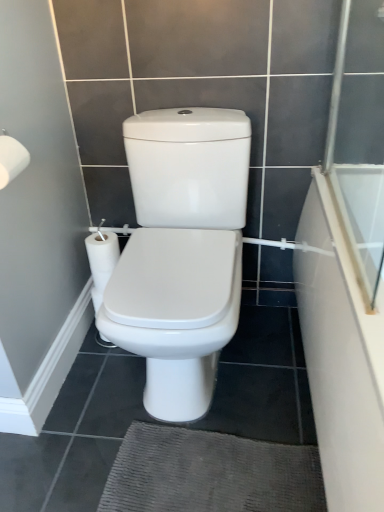
Question: Is transparent glass screen door at right to the left or to the right of white glossy bathtub at right in the image?

Choices:
 (A) right
 (B) left

Answer: (B)

Question: From a real-world perspective, is transparent glass screen door at right physically located above or below white glossy bathtub at right?

Choices:
 (A) above
 (B) below

Answer: (A)

Question: Considering the real-world distances, which object is closest to the white glossy bathtub at right?

Choices:
 (A) white matte toilet paper at upper left
 (B) transparent glass screen door at right

Answer: (B)

Question: Which object is positioned farthest from the white matte toilet paper at upper left?

Choices:
 (A) white glossy bathtub at right
 (B) transparent glass screen door at right

Answer: (B)